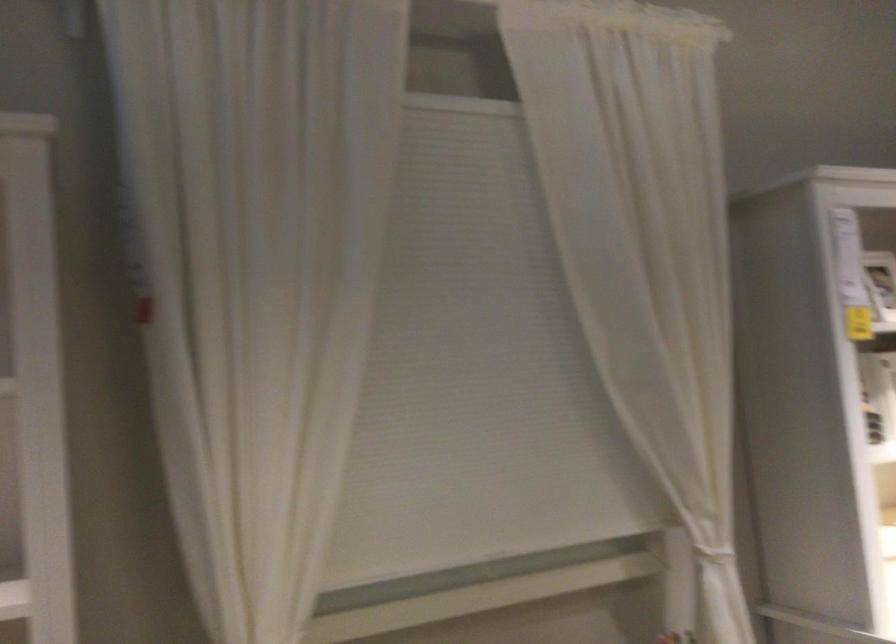
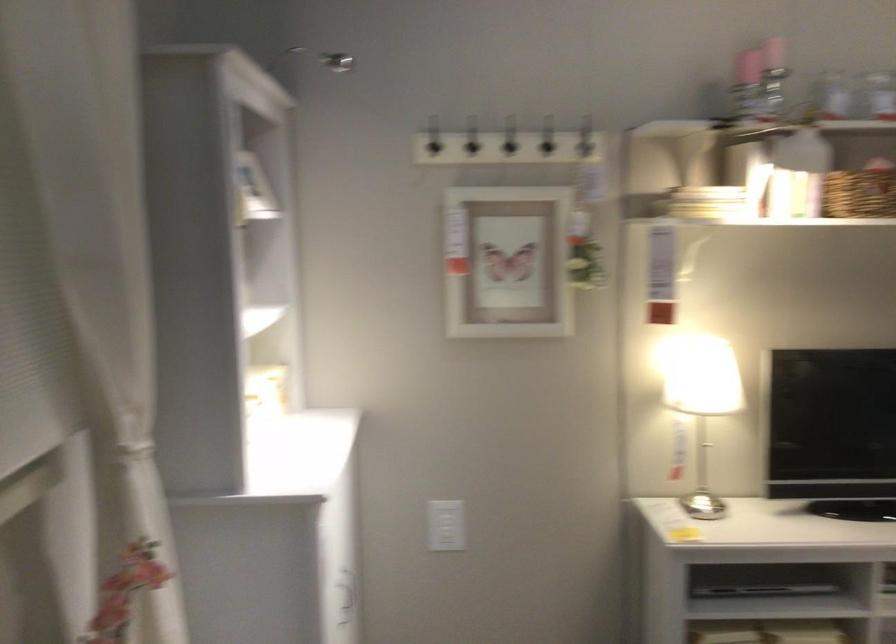
Question: Based on the continuous images, in which direction is the camera rotating? Reply with the corresponding letter.

Choices:
 (A) Left
 (B) Right
 (C) Up
 (D) Down

Answer: (B)